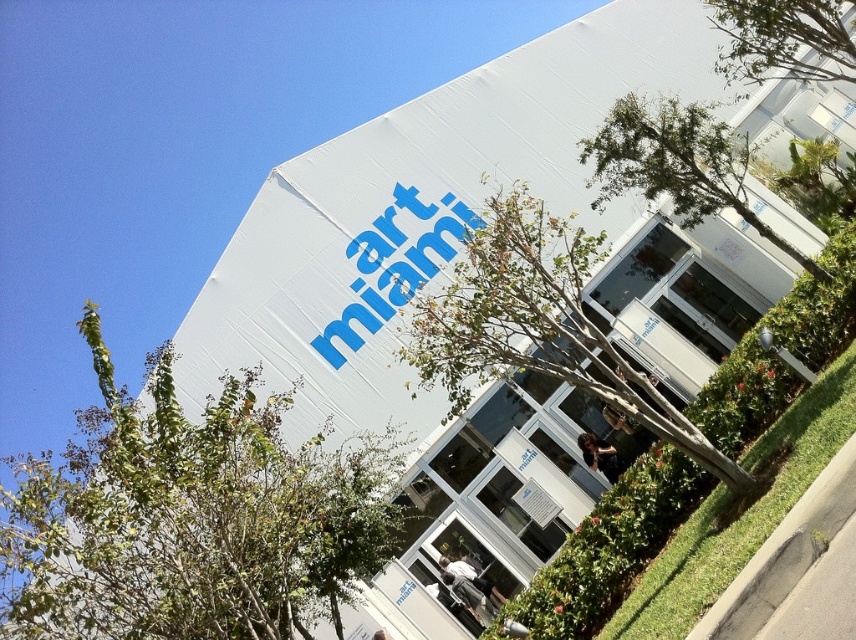
Which is more to the left, transparent glass door at center or green leafy tree at upper right?

Positioned to the left is transparent glass door at center.

Does transparent glass door at center come behind green leafy tree at upper right?

No, transparent glass door at center is in front of green leafy tree at upper right.

What are the coordinates of `transparent glass door at center` in the screenshot? It's located at (538, 324).

This screenshot has width=856, height=640. In order to click on transparent glass door at center in this screenshot , I will do `click(538, 324)`.

Is green leafy tree at upper left in front of green leafy tree at center?

Yes, it is in front of green leafy tree at center.

Can you confirm if green leafy tree at upper left is shorter than green leafy tree at center?

Indeed, green leafy tree at upper left has a lesser height compared to green leafy tree at center.

Which is in front, point (52, 477) or point (596, 132)?

Point (52, 477)

Identify the location of green leafy tree at upper left. The height and width of the screenshot is (640, 856). (189, 518).

From the picture: Who is lower down, green leafy tree at center or green leafy tree at upper right?

green leafy tree at center

Measure the distance from green leafy tree at center to green leafy tree at upper right.

green leafy tree at center and green leafy tree at upper right are 3.30 feet apart from each other.

Who is more forward, (x=617, y=189) or (x=831, y=8)?

Point (x=831, y=8) is in front.

This screenshot has height=640, width=856. In order to click on green leafy tree at center in this screenshot , I will do `click(676, 163)`.